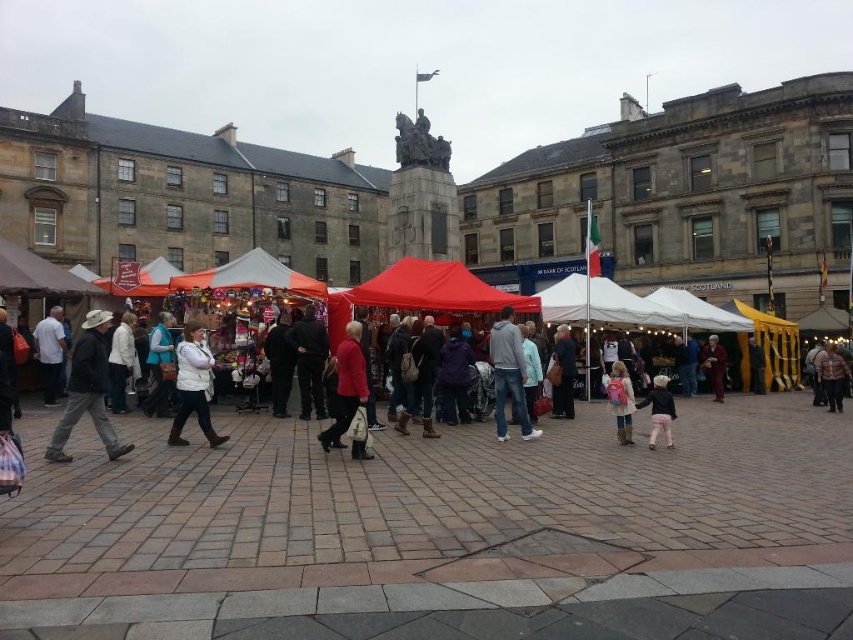
Does light pink fabric pants at lower right appear on the left side of brown woolen hat at lower right?

Yes, light pink fabric pants at lower right is to the left of brown woolen hat at lower right.

Which of these two, light pink fabric pants at lower right or brown woolen hat at lower right, stands shorter?

brown woolen hat at lower right is shorter.

The width and height of the screenshot is (853, 640). I want to click on light pink fabric pants at lower right, so click(659, 410).

Identify the location of light pink fabric pants at lower right. (659, 410).

In the scene shown: Is white fleece vest at center thinner than light pink fabric pants at lower right?

Correct, white fleece vest at center's width is less than light pink fabric pants at lower right's.

Who is more distant from viewer, (212,362) or (653,406)?

The point (653,406) is behind.

Locate an element on the screen. white fleece vest at center is located at coordinates (192, 387).

The image size is (853, 640). What are the coordinates of `white fleece vest at center` in the screenshot? It's located at (192, 387).

Is brown fuzzy coat at lower right further to the viewer compared to brown woolen hat at lower right?

No, it is not.

Identify the location of brown fuzzy coat at lower right. The width and height of the screenshot is (853, 640). (833, 378).

Locate an element on the screen. brown fuzzy coat at lower right is located at coordinates (833, 378).